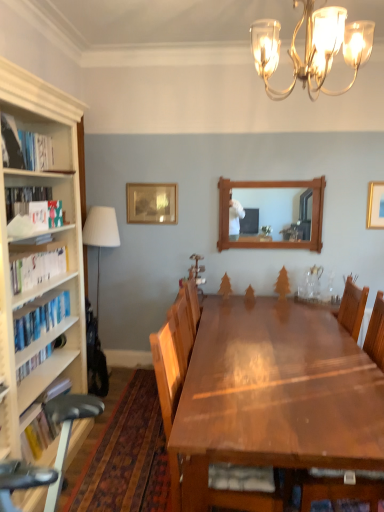
Question: Visually, is gold metallic picture frame at upper right, the 1th picture frame when ordered from right to left, positioned to the left or to the right of white fabric lampshade at left?

Choices:
 (A) left
 (B) right

Answer: (B)

Question: In terms of width, does gold metallic picture frame at upper right, the first picture frame positioned from the front, look wider or thinner when compared to white fabric lampshade at left?

Choices:
 (A) wide
 (B) thin

Answer: (B)

Question: Estimate the real-world distances between objects in this image. Which object is farther from the hardcover books at left, which is counted as the 4th book, starting from the top?

Choices:
 (A) gold metallic picture frame at upper right, the 1th picture frame when ordered from right to left
 (B) wooden frame mirror at center
 (C) gold metallic chandelier at upper center
 (D) white paperbacks at left, the third book from the top
 (E) white fabric lampshade at left

Answer: (B)

Question: Which object is the farthest from the shiny brown wooden table at center?

Choices:
 (A) wooden picture frame at upper center, which appears as the 2th picture frame when viewed from the front
 (B) white paperbacks at left, which appears as the 3th book when ordered from the bottom
 (C) hardcover book at left, which appears as the fourth book when ordered from the bottom
 (D) wooden chair at center
 (E) hardcover books at left, the second book positioned from the bottom

Answer: (A)